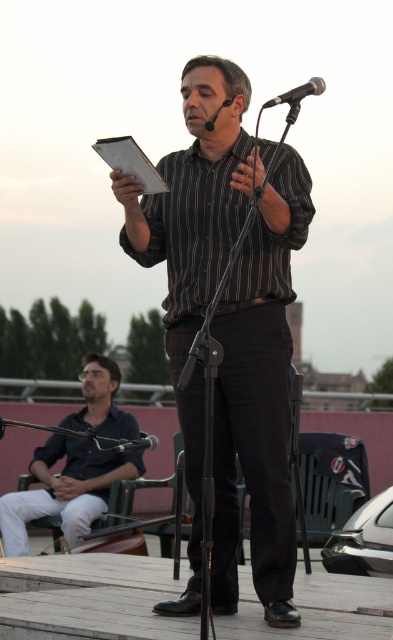
From the picture: You are an event planner standing at the back of the stage. You need to move from the dark blue shirt at lower left to the metallic silver microphone at center. Which direction should you move to reach the microphone?

To reach the metallic silver microphone at center from the dark blue shirt at lower left, you should move to the right since the dark blue shirt at lower left is located to the left of the microphone.

You are a stagehand who needs to adjust the microphone so it faces the speaker on the stage. The dark blue shirt at lower left is an audience member sitting in the front row. Which direction should you move the black matte microphone at center to ensure it points toward the speaker?

The black matte microphone at center is currently behind the dark blue shirt at lower left. To face the speaker on the stage, move the microphone forward so it is in front of the dark blue shirt at lower left, ensuring it points toward the speaker.

You are setting up a stage for a small event and need to place a 20cm wide decorative item between the dark blue shirt at lower left and the metallic silver microphone at center. Can you fit it there?

The dark blue shirt at lower left is wider than the metallic silver microphone at center. Therefore, there might be enough space between them to fit a 20cm wide decorative item, but you should measure the exact distance to confirm.